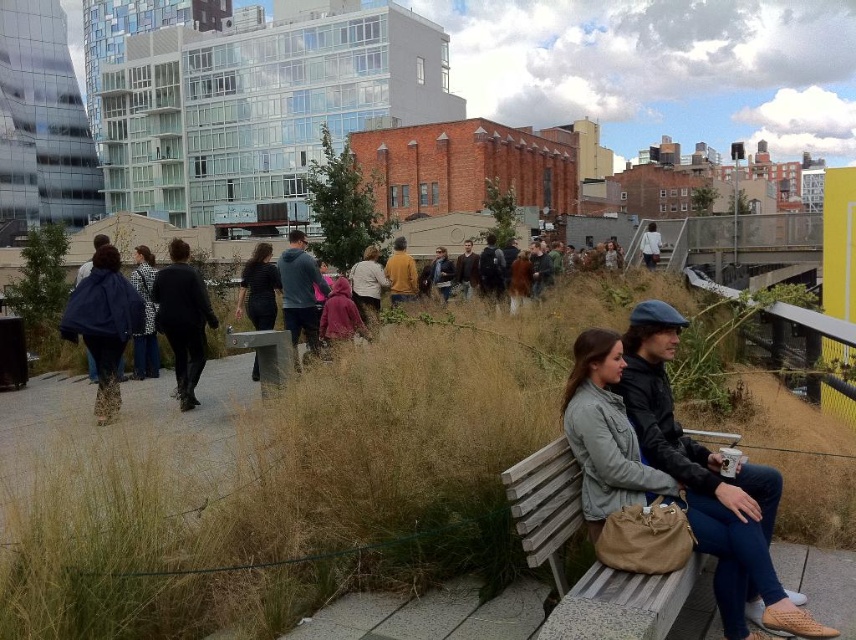
Question: Among these objects, which one is farthest from the camera?

Choices:
 (A) matte blue hoodie at center
 (B) matte black jacket at center
 (C) mustard yellow sweater at center

Answer: (C)

Question: Is velvet maroon coat at center bigger than light blue denim jacket at upper center?

Choices:
 (A) no
 (B) yes

Answer: (A)

Question: Which point is farther from the camera taking this photo?

Choices:
 (A) (461, 266)
 (B) (539, 285)
 (C) (651, 596)

Answer: (A)

Question: Does black matte jacket at center appear under plaid fabric coat at center?

Choices:
 (A) yes
 (B) no

Answer: (A)

Question: Among these objects, which one is nearest to the camera?

Choices:
 (A) leopard print coat at center
 (B) brown leather jacket at center
 (C) mustard yellow sweater at center

Answer: (A)

Question: Is dark brown backpack at center below brown leather jacket at center?

Choices:
 (A) yes
 (B) no

Answer: (A)